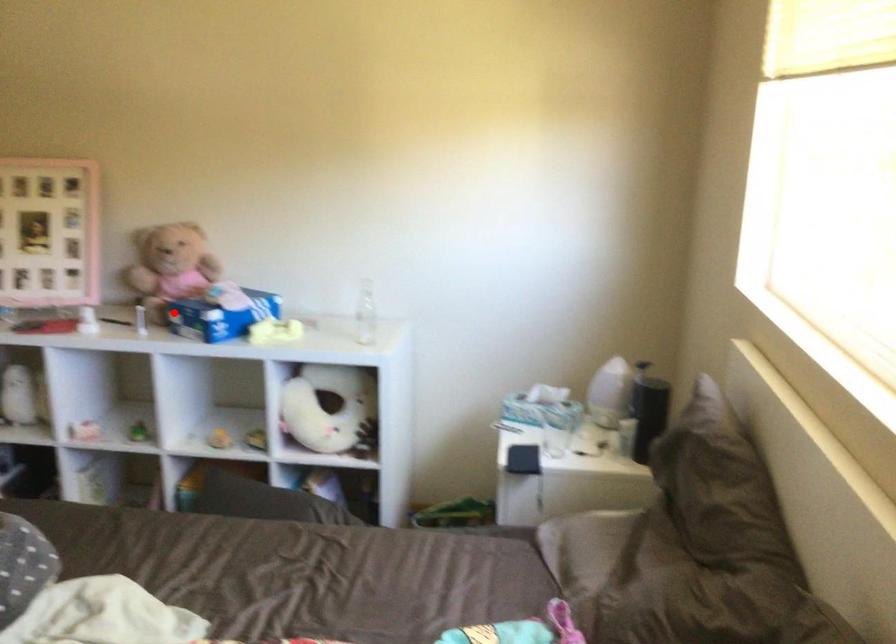
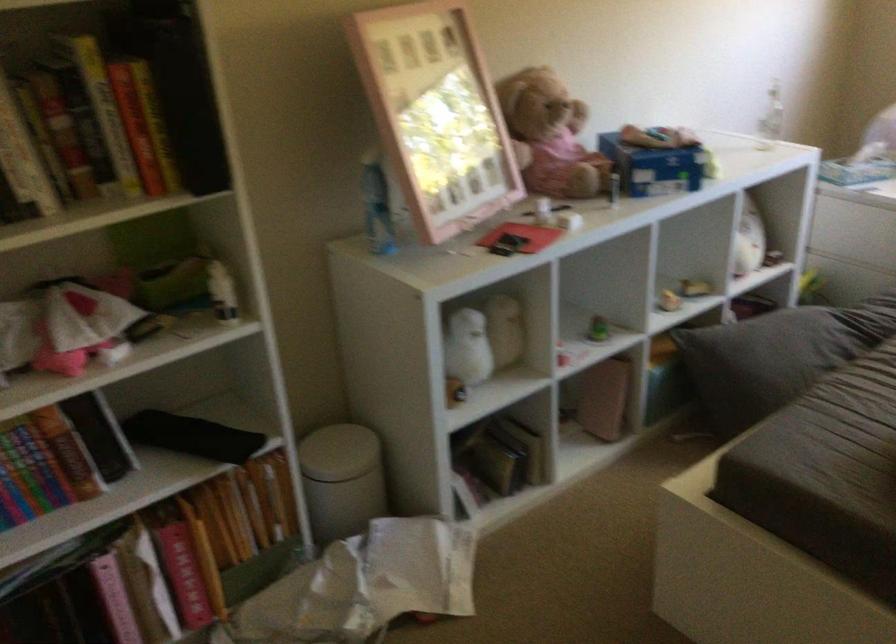
Question: I am providing you with two images of the same scene from different viewpoints. In image1, a red point is highlighted. Considering the same 3D point in image2, which of the following is correct?

Choices:
 (A) It is closer
 (B) It is farther

Answer: (A)